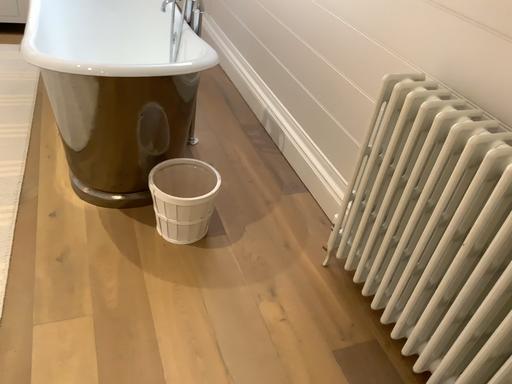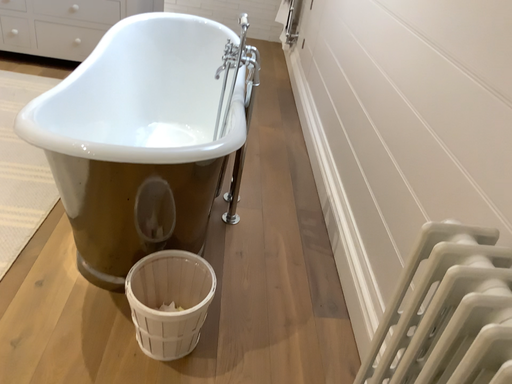
Question: Which way did the camera rotate in the video?

Choices:
 (A) rotated left
 (B) rotated right

Answer: (A)